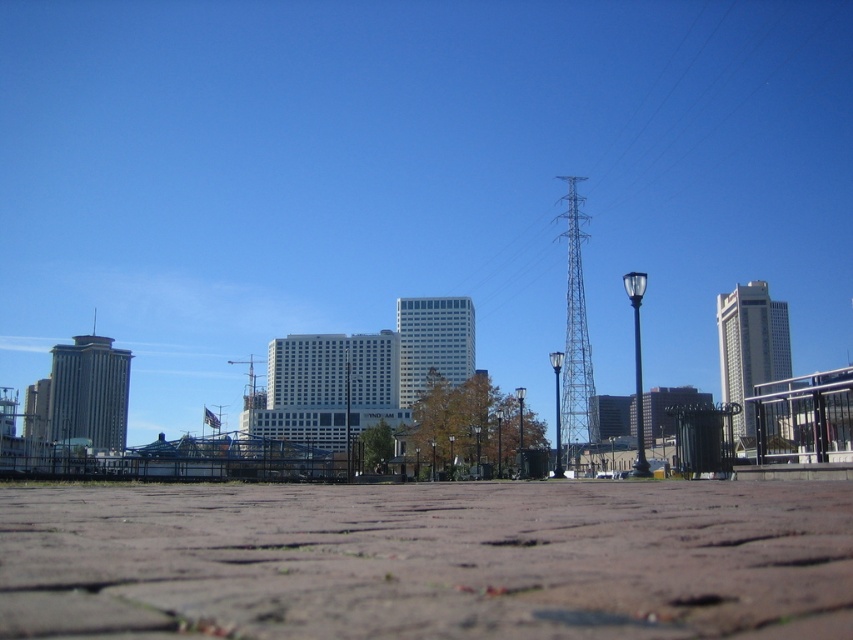
Question: Considering the real-world distances, which object is farthest from the metallic blue tower at center-right?

Choices:
 (A) black metal pole at right
 (B) metallic pole at center
 (C) metallic silver pole at center
 (D) metallic tower at upper center

Answer: (B)

Question: Among these objects, which one is farthest from the camera?

Choices:
 (A) metallic blue tower at center-right
 (B) black metal pole at right
 (C) metallic silver pole at center
 (D) metallic pole at center

Answer: (C)

Question: Is metallic tower at upper center bigger than gray metallic building at left?

Choices:
 (A) no
 (B) yes

Answer: (B)

Question: Which point is closer to the camera?

Choices:
 (A) (102, 369)
 (B) (518, 396)
 (C) (635, 385)

Answer: (B)

Question: Is white glass skyscraper at right positioned behind metallic silver pole at center?

Choices:
 (A) yes
 (B) no

Answer: (B)

Question: Does metallic blue tower at center-right appear on the right side of black metal pole at right?

Choices:
 (A) yes
 (B) no

Answer: (A)